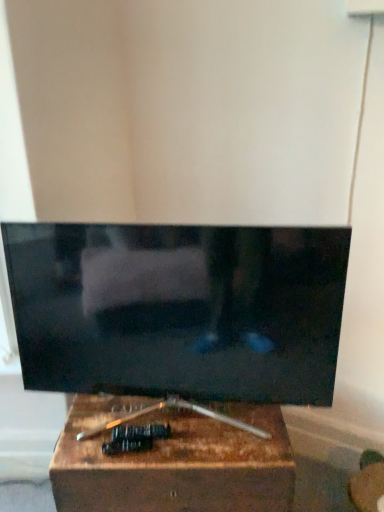
Question: From the image's perspective, is wooden box at center located beneath matte black tv at center?

Choices:
 (A) yes
 (B) no

Answer: (A)

Question: Does wooden box at center have a lesser height compared to matte black tv at center?

Choices:
 (A) no
 (B) yes

Answer: (B)

Question: Can you confirm if wooden box at center is taller than matte black tv at center?

Choices:
 (A) yes
 (B) no

Answer: (B)

Question: From the image's perspective, is wooden box at center on top of matte black tv at center?

Choices:
 (A) yes
 (B) no

Answer: (B)

Question: Is wooden box at center not inside matte black tv at center?

Choices:
 (A) yes
 (B) no

Answer: (A)

Question: Does wooden box at center lie in front of matte black tv at center?

Choices:
 (A) no
 (B) yes

Answer: (A)

Question: Is the depth of matte black tv at center greater than that of wooden box at center?

Choices:
 (A) no
 (B) yes

Answer: (A)

Question: From a real-world perspective, does matte black tv at center stand above wooden box at center?

Choices:
 (A) yes
 (B) no

Answer: (A)

Question: From the image's perspective, is matte black tv at center above wooden box at center?

Choices:
 (A) no
 (B) yes

Answer: (B)

Question: Considering the relative sizes of matte black tv at center and wooden box at center in the image provided, is matte black tv at center wider than wooden box at center?

Choices:
 (A) yes
 (B) no

Answer: (B)

Question: Can you confirm if matte black tv at center is smaller than wooden box at center?

Choices:
 (A) no
 (B) yes

Answer: (B)

Question: Would you consider matte black tv at center to be distant from wooden box at center?

Choices:
 (A) no
 (B) yes

Answer: (A)

Question: Would you say matte black tv at center is inside or outside wooden box at center?

Choices:
 (A) outside
 (B) inside

Answer: (A)